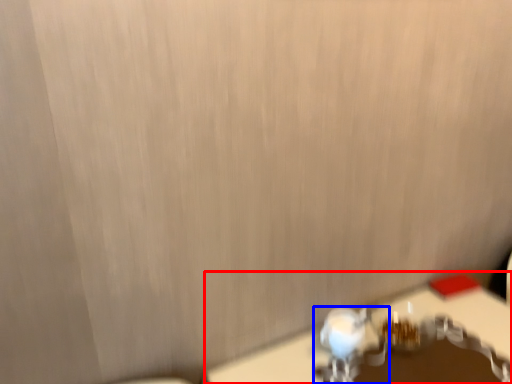
Question: Which of the following is the closest to the observer, table (highlighted by a red box) or faucet (highlighted by a blue box)?

Choices:
 (A) table
 (B) faucet

Answer: (A)